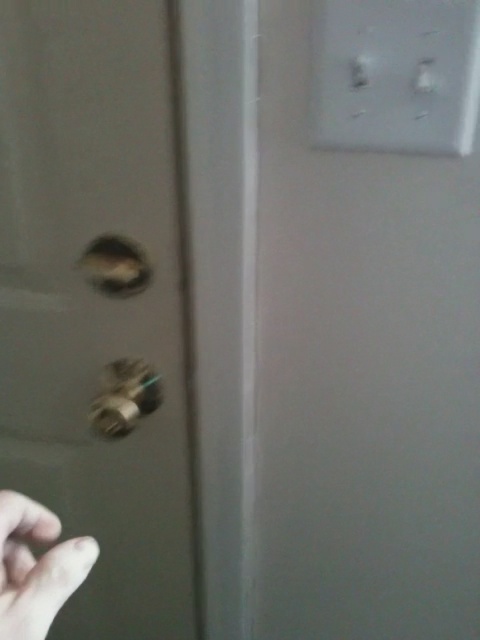
Consider the image. Between skinny white hand at lower left and metallic gold door handle at left, which one appears on the right side from the viewer's perspective?

skinny white hand at lower left is more to the right.

Does skinny white hand at lower left appear over metallic gold door handle at left?

No.

I want to click on skinny white hand at lower left, so click(36, 566).

Describe the element at coordinates (96, 305) in the screenshot. Image resolution: width=480 pixels, height=640 pixels. I see `matte gold door handle at left` at that location.

Is matte gold door handle at left above metallic knob at upper left?

Incorrect, matte gold door handle at left is not positioned above metallic knob at upper left.

Does point (104, 176) lie in front of point (105, 244)?

That is True.

At what (x,y) coordinates should I click in order to perform the action: click on matte gold door handle at left. Please return your answer as a coordinate pair (x, y). Looking at the image, I should click on pyautogui.click(x=96, y=305).

Between point (164, 532) and point (95, 541), which one is positioned in front?

Point (164, 532) is more forward.

This screenshot has width=480, height=640. Describe the element at coordinates (96, 305) in the screenshot. I see `matte gold door handle at left` at that location.

Find the location of a particular element. matte gold door handle at left is located at coordinates (96, 305).